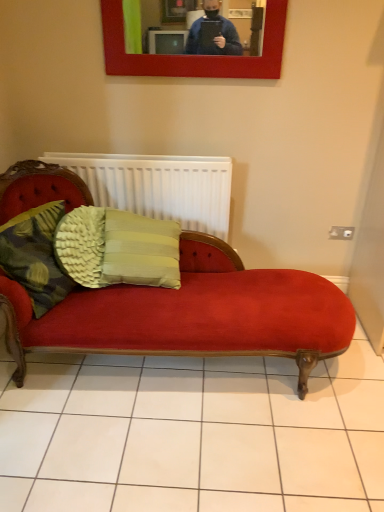
Question: From the image's perspective, is green textured cushion at center, positioned as the 1th pillow in right-to-left order, on white matte radiator at center?

Choices:
 (A) yes
 (B) no

Answer: (B)

Question: From a real-world perspective, is green textured cushion at center, the second pillow when ordered from left to right, located beneath white matte radiator at center?

Choices:
 (A) yes
 (B) no

Answer: (A)

Question: Considering the relative sizes of green textured cushion at center, positioned as the 1th pillow in right-to-left order, and white matte radiator at center in the image provided, is green textured cushion at center, positioned as the 1th pillow in right-to-left order, shorter than white matte radiator at center?

Choices:
 (A) no
 (B) yes

Answer: (A)

Question: From a real-world perspective, is green textured cushion at center, positioned as the 1th pillow in right-to-left order, located higher than white matte radiator at center?

Choices:
 (A) no
 (B) yes

Answer: (A)

Question: Is woven fabric cushion at left, positioned as the second pillow in right-to-left order, bigger or smaller than white matte radiator at center?

Choices:
 (A) big
 (B) small

Answer: (B)

Question: Which is correct: woven fabric cushion at left, placed as the first pillow when sorted from left to right, is inside white matte radiator at center, or outside of it?

Choices:
 (A) inside
 (B) outside

Answer: (B)

Question: Relative to white matte radiator at center, is woven fabric cushion at left, positioned as the second pillow in right-to-left order, in front or behind?

Choices:
 (A) front
 (B) behind

Answer: (A)

Question: From a real-world perspective, relative to white matte radiator at center, is woven fabric cushion at left, placed as the first pillow when sorted from left to right, vertically above or below?

Choices:
 (A) above
 (B) below

Answer: (B)

Question: From the image's perspective, relative to woven fabric cushion at left, positioned as the second pillow in right-to-left order, is green textured cushion at center, positioned as the 1th pillow in right-to-left order, above or below?

Choices:
 (A) below
 (B) above

Answer: (B)

Question: In the image, is green textured cushion at center, positioned as the 1th pillow in right-to-left order, positioned in front of or behind woven fabric cushion at left, positioned as the second pillow in right-to-left order?

Choices:
 (A) behind
 (B) front

Answer: (A)

Question: Would you say green textured cushion at center, the second pillow when ordered from left to right, is inside or outside woven fabric cushion at left, positioned as the second pillow in right-to-left order?

Choices:
 (A) inside
 (B) outside

Answer: (B)

Question: From a real-world perspective, is green textured cushion at center, positioned as the 1th pillow in right-to-left order, physically located above or below woven fabric cushion at left, placed as the first pillow when sorted from left to right?

Choices:
 (A) above
 (B) below

Answer: (B)

Question: Considering the positions of green textured cushion at center, positioned as the 1th pillow in right-to-left order, and white matte radiator at center in the image, is green textured cushion at center, positioned as the 1th pillow in right-to-left order, wider or thinner than white matte radiator at center?

Choices:
 (A) thin
 (B) wide

Answer: (B)

Question: Is point (64, 225) closer or farther from the camera than point (203, 224)?

Choices:
 (A) farther
 (B) closer

Answer: (B)